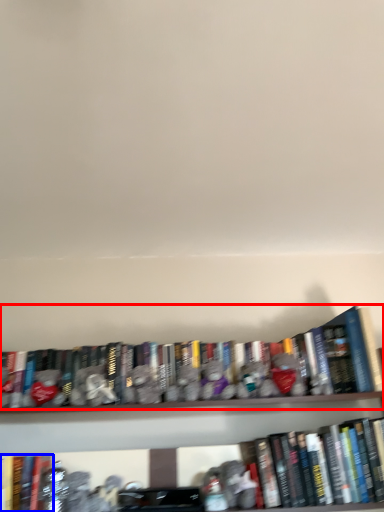
Question: Which object is further to the camera taking this photo, book (highlighted by a red box) or book (highlighted by a blue box)?

Choices:
 (A) book
 (B) book

Answer: (A)